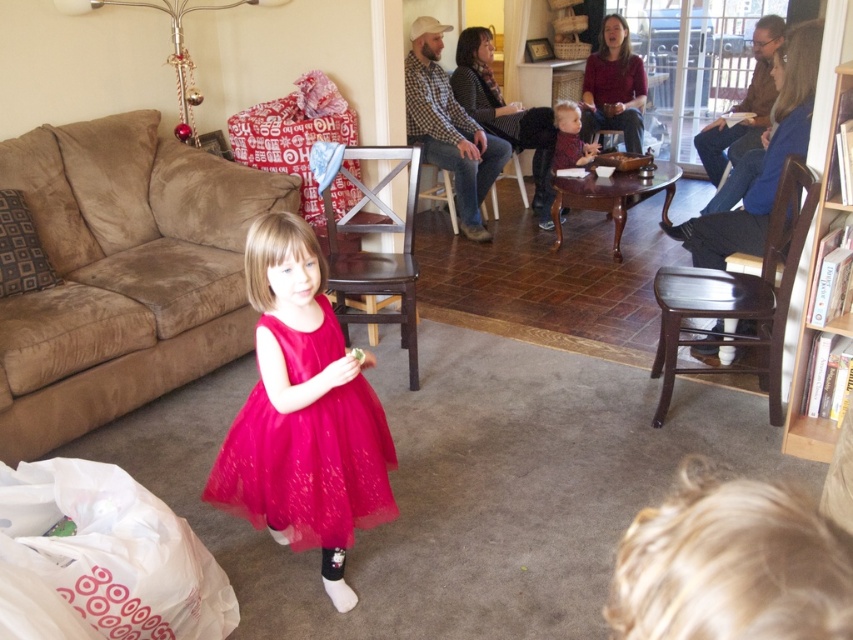
In the scene shown: Is suede couch at lower left further to camera compared to fuchsia tulle dress at center?

That is True.

Locate an element on the screen. suede couch at lower left is located at coordinates (122, 273).

Where is `suede couch at lower left`? suede couch at lower left is located at coordinates (122, 273).

Between suede couch at lower left and matte red sweater at center, which one has more height?

suede couch at lower left is taller.

Does suede couch at lower left have a greater height compared to matte red sweater at center?

Indeed, suede couch at lower left has a greater height compared to matte red sweater at center.

Is point (200, 346) positioned behind point (569, 156)?

No, (200, 346) is in front of (569, 156).

Where is `suede couch at lower left`? suede couch at lower left is located at coordinates (122, 273).

Who is taller, fuchsia tulle dress at center or matte red sweater at center?

With more height is matte red sweater at center.

Between fuchsia tulle dress at center and matte red sweater at center, which one appears on the right side from the viewer's perspective?

From the viewer's perspective, matte red sweater at center appears more on the right side.

Measure the distance between point (386, 460) and camera.

Point (386, 460) is 7.60 feet away from camera.

Where is `fuchsia tulle dress at center`? This screenshot has height=640, width=853. fuchsia tulle dress at center is located at coordinates tap(306, 467).